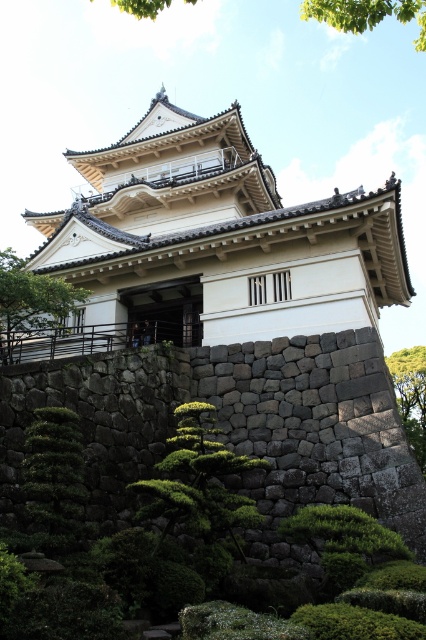
You are standing in front of the Japanese building and see a point marked at coordinates (x=198, y=481). What object is located at that point?

The point at coordinates (x=198, y=481) marks a green leafy bush at lower center.